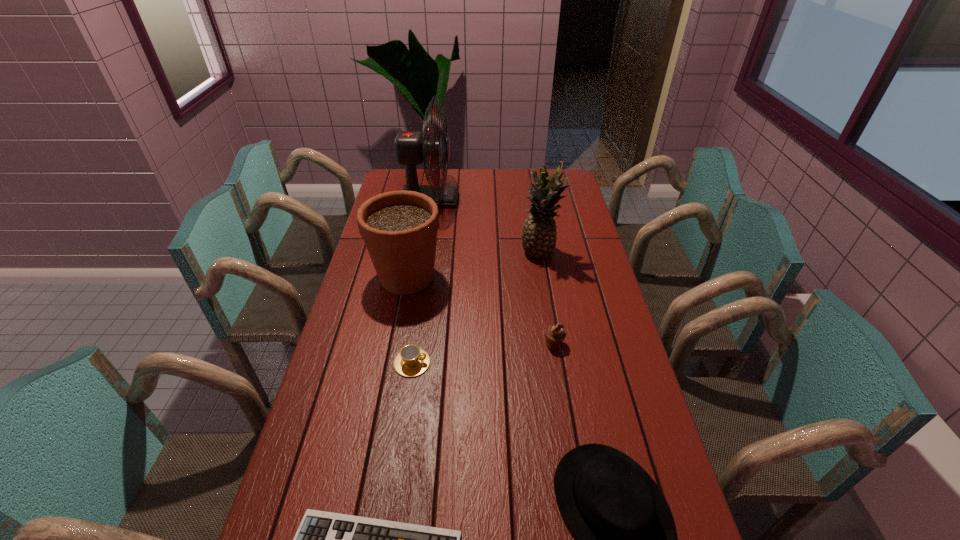
You are a GUI agent. You are given a task and a screenshot of the screen. Output one action in this format:
    pyautogui.click(x=<x>, y=<y>)
    Task: Click on the vacant space located 0.380m with the handle on the side of the cup
    The height and width of the screenshot is (540, 960).
    Given the screenshot: What is the action you would take?
    pyautogui.click(x=562, y=363)

Where is `object at the far edge`? The image size is (960, 540). object at the far edge is located at coordinates (411, 147).

Locate an element on the screen. The height and width of the screenshot is (540, 960). fan present at the left edge is located at coordinates (411, 147).

The image size is (960, 540). Find the location of `flowerpot present at the left edge`. flowerpot present at the left edge is located at coordinates (399, 228).

Where is `object that is at the right edge`? The image size is (960, 540). object that is at the right edge is located at coordinates (539, 232).

This screenshot has width=960, height=540. In order to click on object positioned at the far left corner in this screenshot , I will do `click(411, 147)`.

At what (x,y) coordinates should I click in order to perform the action: click on vacant area at the far edge of the desktop. Please return your answer as a coordinate pair (x, y). Looking at the image, I should click on (470, 193).

Locate an element on the screen. The image size is (960, 540). free space at the left edge is located at coordinates (376, 296).

Where is `free space at the far left corner of the desktop`? This screenshot has height=540, width=960. free space at the far left corner of the desktop is located at coordinates (396, 174).

Image resolution: width=960 pixels, height=540 pixels. What are the coordinates of `empty space that is in between the tallest object and the muffin` in the screenshot? It's located at (492, 272).